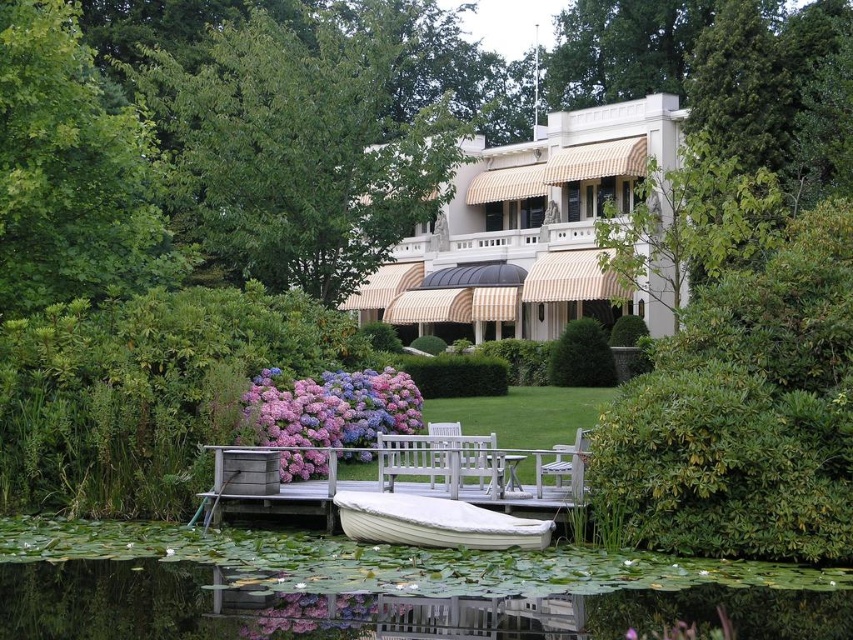
Question: Among these points, which one is nearest to the camera?

Choices:
 (A) (393, 454)
 (B) (448, 536)

Answer: (B)

Question: In this image, where is purple matte hydrangea at center located relative to white canvas boat at lower center?

Choices:
 (A) below
 (B) above

Answer: (B)

Question: Which point is farther to the camera?

Choices:
 (A) (296, 499)
 (B) (549, 474)
 (C) (544, 541)

Answer: (A)

Question: Estimate the real-world distances between objects in this image. Which object is closer to the green leafy tree at left?

Choices:
 (A) white canvas boat at lower center
 (B) purple matte hydrangea at center
 (C) green leafy tree at upper left

Answer: (B)

Question: Does green leafy tree at upper left lie behind purple matte hydrangea at center?

Choices:
 (A) yes
 (B) no

Answer: (A)

Question: Does white canvas boat at lower center have a smaller size compared to wooden chair at center?

Choices:
 (A) yes
 (B) no

Answer: (B)